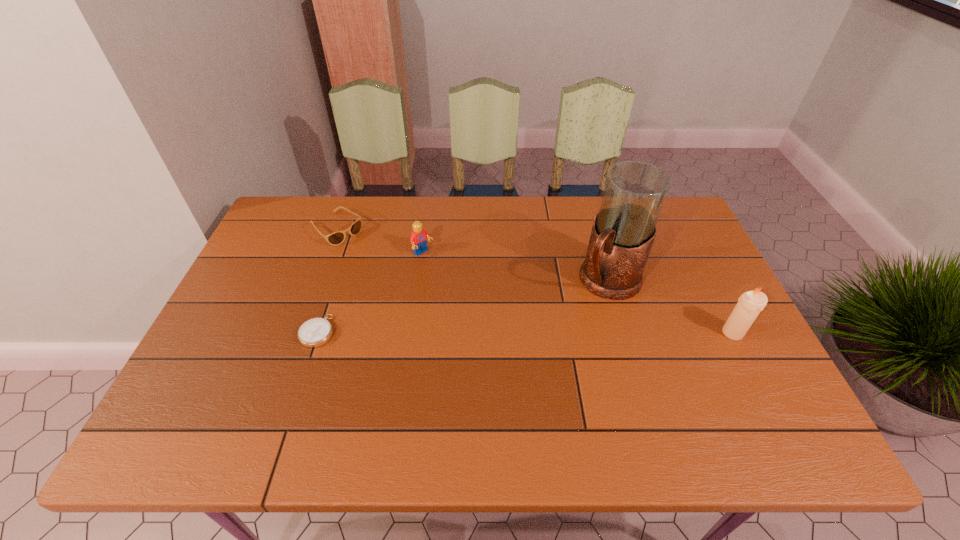
Locate an element on the screen. free space located 0.320m with the handle on the side of the tallest object is located at coordinates (520, 380).

You are a GUI agent. You are given a task and a screenshot of the screen. Output one action in this format:
    pyautogui.click(x=<x>, y=<y>)
    Task: Click on the free region located with the handle on the side of the tallest object
    This screenshot has width=960, height=540.
    Given the screenshot: What is the action you would take?
    pyautogui.click(x=502, y=400)

This screenshot has height=540, width=960. Identify the location of free location located with the handle on the side of the tallest object. (499, 403).

Locate an element on the screen. The image size is (960, 540). blank space located on the face of the third object from left to right is located at coordinates (450, 276).

This screenshot has width=960, height=540. What are the coordinates of `vacant space located 0.190m on the face of the third object from left to right` in the screenshot? It's located at (471, 293).

Image resolution: width=960 pixels, height=540 pixels. I want to click on vacant space located 0.360m on the face of the third object from left to right, so click(x=515, y=329).

At what (x,y) coordinates should I click in order to perform the action: click on vacant region located 0.150m on the front-facing side of the sunglasses. Please return your answer as a coordinate pair (x, y). This screenshot has width=960, height=540. Looking at the image, I should click on (381, 266).

Identify the location of vacant space located 0.150m on the front-facing side of the sunglasses. The width and height of the screenshot is (960, 540). (381, 266).

Where is `vacant space located on the front-facing side of the sunglasses`? Image resolution: width=960 pixels, height=540 pixels. vacant space located on the front-facing side of the sunglasses is located at coordinates (421, 297).

In order to click on object located in the far edge section of the desktop in this screenshot , I will do `click(336, 238)`.